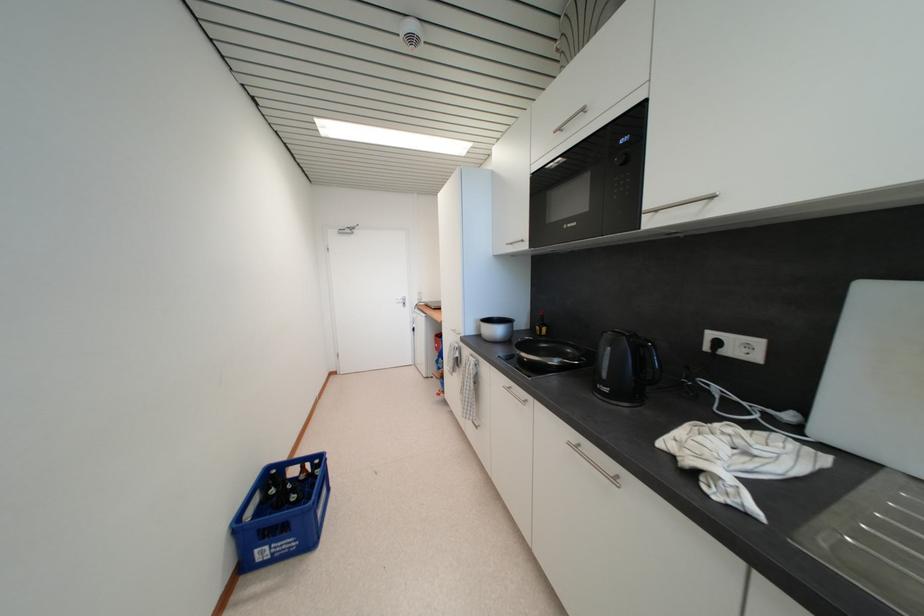
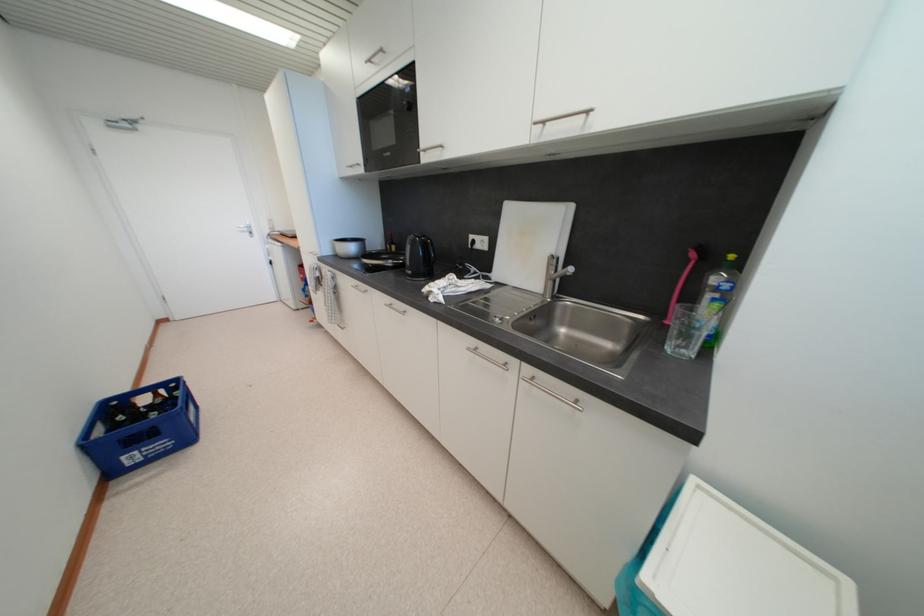
In the second image, find the point that corresponds to point 268,554 in the first image.

(138, 460)